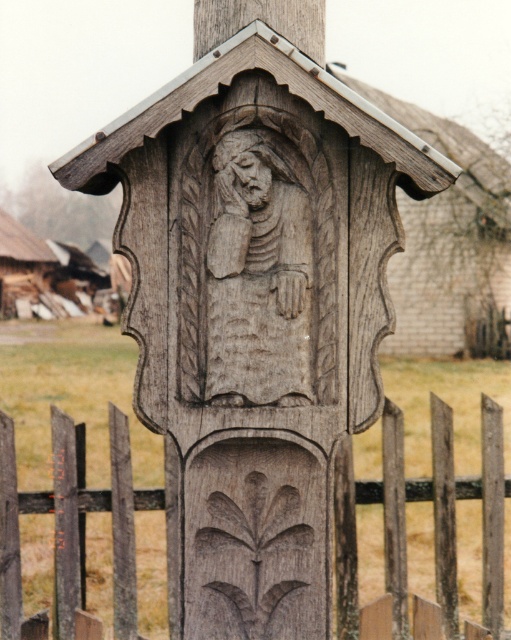
Who is positioned more to the left, wooden carved figure at center or carved wood face at center?

From the viewer's perspective, carved wood face at center appears more on the left side.

Can you confirm if wooden carved figure at center is smaller than carved wood face at center?

No.

Which is behind, point (293, 372) or point (265, 182)?

Point (293, 372)

The width and height of the screenshot is (511, 640). I want to click on wooden carved figure at center, so click(x=258, y=278).

Can you confirm if weathered wood fence at lower center is smaller than carved wood face at center?

No, weathered wood fence at lower center is not smaller than carved wood face at center.

Consider the image. Is weathered wood fence at lower center bigger than carved wood face at center?

Yes.

The image size is (511, 640). Describe the element at coordinates (81, 531) in the screenshot. I see `weathered wood fence at lower center` at that location.

You are a GUI agent. You are given a task and a screenshot of the screen. Output one action in this format:
    pyautogui.click(x=<x>, y=<y>)
    Task: Click on the weathered wood fence at lower center
    Image resolution: width=511 pixels, height=640 pixels.
    Given the screenshot: What is the action you would take?
    pyautogui.click(x=81, y=531)

Does weathered wood fence at lower center appear on the left side of wooden carved figure at center?

Yes, weathered wood fence at lower center is to the left of wooden carved figure at center.

Which of these two, weathered wood fence at lower center or wooden carved figure at center, stands taller?

Standing taller between the two is weathered wood fence at lower center.

Is point (454, 588) positioned before point (250, 182)?

No, it is not.

The width and height of the screenshot is (511, 640). Find the location of `weathered wood fence at lower center`. weathered wood fence at lower center is located at coordinates (81, 531).